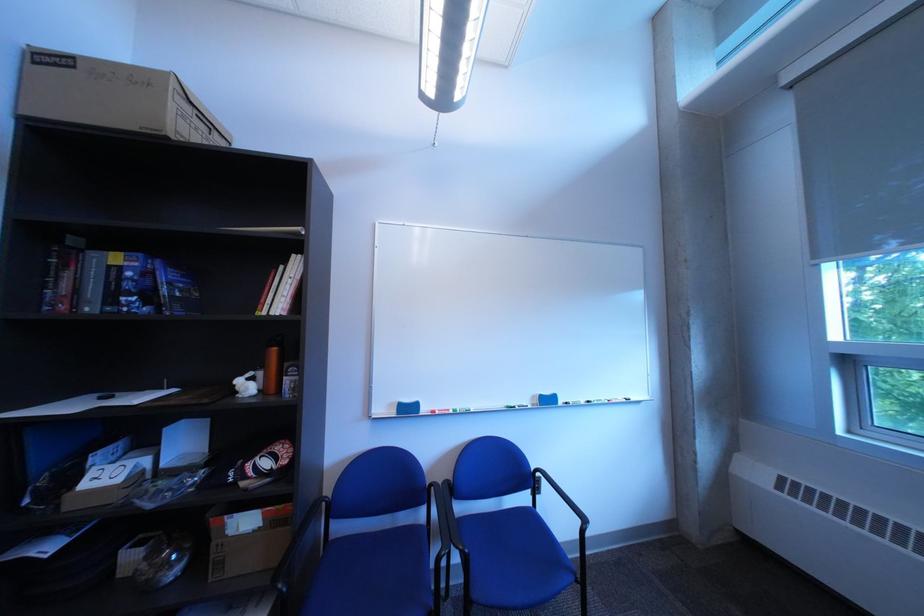
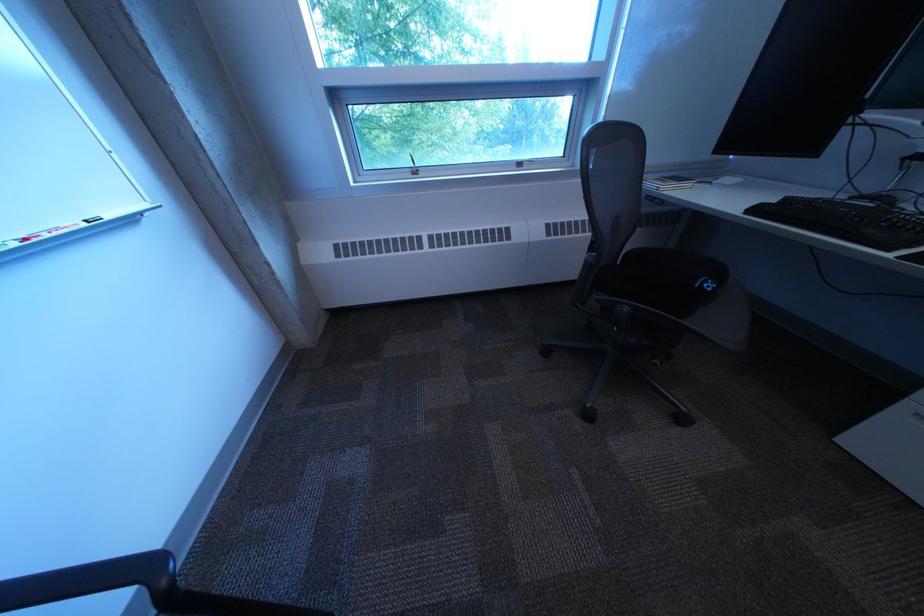
First-person continuous shooting, in which direction is the camera rotating?

The camera rotated toward right-down.